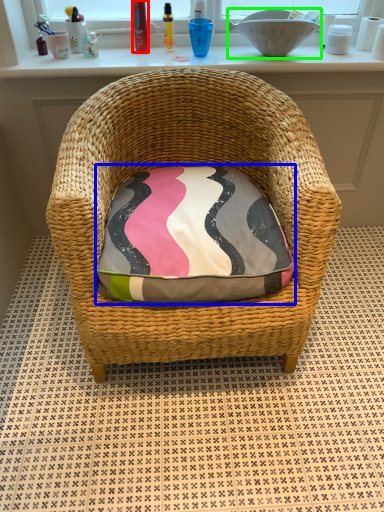
Question: Estimate the real-world distances between objects in this image. Which object is closer to toiletry (highlighted by a red box), throw pillow (highlighted by a blue box) or sink (highlighted by a green box)?

Choices:
 (A) throw pillow
 (B) sink

Answer: (B)